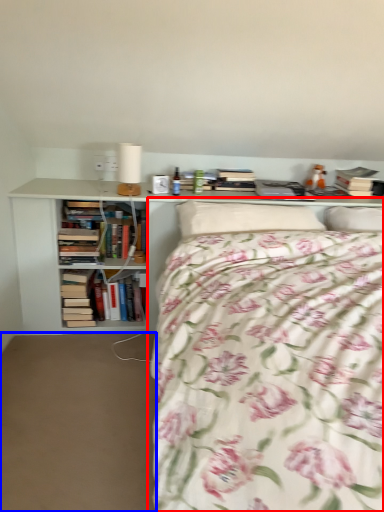
Question: Which object appears closest to the camera in this image, bed (highlighted by a red box) or plain (highlighted by a blue box)?

Choices:
 (A) bed
 (B) plain

Answer: (A)